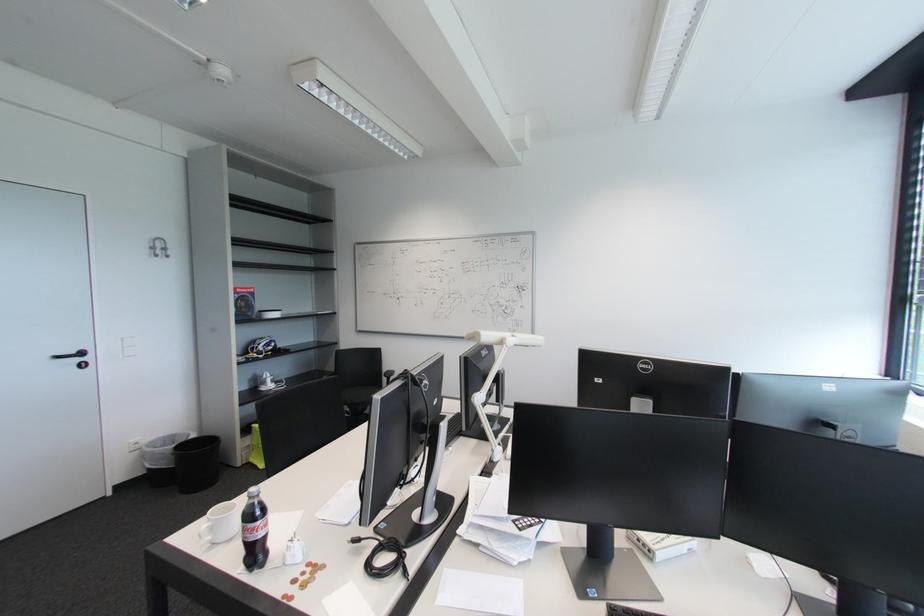
Where would you lift the red book box? Please return your answer as a coordinate pair (x, y).

(244, 302)